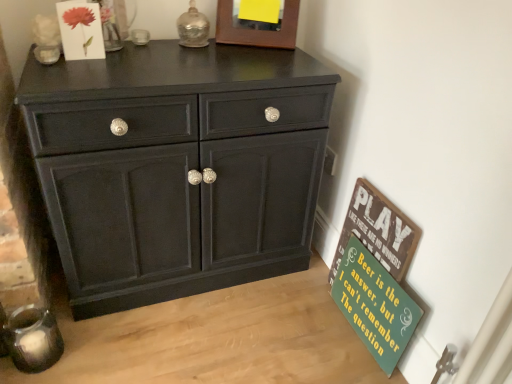
The height and width of the screenshot is (384, 512). What do you see at coordinates (378, 230) in the screenshot?
I see `green painted wood signboard at lower right, placed as the second bulletin board when sorted from bottom to top` at bounding box center [378, 230].

Locate an element on the screen. This screenshot has height=384, width=512. green wood signboard at lower right, which is counted as the 1th bulletin board, starting from the bottom is located at coordinates (374, 304).

Can green painted wood signboard at lower right, which ranks as the 1th bulletin board in top-to-bottom order, be found inside green wood signboard at lower right, which is counted as the 1th bulletin board, starting from the bottom?

That's correct, green painted wood signboard at lower right, which ranks as the 1th bulletin board in top-to-bottom order, is inside green wood signboard at lower right, which is counted as the 1th bulletin board, starting from the bottom.

Image resolution: width=512 pixels, height=384 pixels. What are the coordinates of `bulletin board below the green painted wood signboard at lower right, placed as the second bulletin board when sorted from bottom to top (from the image's perspective)` in the screenshot? It's located at (374, 304).

Considering the positions of objects green wood signboard at lower right, which is counted as the 1th bulletin board, starting from the bottom, and green painted wood signboard at lower right, placed as the second bulletin board when sorted from bottom to top, in the image provided, who is more to the left, green wood signboard at lower right, which is counted as the 1th bulletin board, starting from the bottom, or green painted wood signboard at lower right, placed as the second bulletin board when sorted from bottom to top,?

green painted wood signboard at lower right, placed as the second bulletin board when sorted from bottom to top.

Is matte black cabinet at center wider or thinner than green painted wood signboard at lower right, placed as the second bulletin board when sorted from bottom to top?

matte black cabinet at center is wider than green painted wood signboard at lower right, placed as the second bulletin board when sorted from bottom to top.

Which of these two, matte black cabinet at center or green painted wood signboard at lower right, placed as the second bulletin board when sorted from bottom to top, is smaller?

With smaller size is green painted wood signboard at lower right, placed as the second bulletin board when sorted from bottom to top.

From a real-world perspective, is matte black cabinet at center physically located above or below green painted wood signboard at lower right, placed as the second bulletin board when sorted from bottom to top?

matte black cabinet at center is situated higher than green painted wood signboard at lower right, placed as the second bulletin board when sorted from bottom to top, in the real world.

From a real-world perspective, is matte paper flower at upper left physically below matte black cabinet at center?

No, from a real-world perspective, matte paper flower at upper left is not beneath matte black cabinet at center.

Does matte paper flower at upper left appear on the right side of matte black cabinet at center?

No.

Considering the relative sizes of matte paper flower at upper left and matte black cabinet at center in the image provided, is matte paper flower at upper left smaller than matte black cabinet at center?

Yes.

From the image's perspective, who appears lower, matte paper flower at upper left or matte black cabinet at center?

matte black cabinet at center, from the image's perspective.

Starting from the wooden picture frame at upper center, which bulletin board is the 2nd one to the right? Please provide its 2D coordinates.

[(374, 304)]

Based on the photo, which of these two, green wood signboard at lower right, the second bulletin board positioned from the top, or wooden picture frame at upper center, is thinner?

With smaller width is wooden picture frame at upper center.

Does point (347, 319) come behind point (289, 1)?

That is True.

From a real-world perspective, who is located lower, green wood signboard at lower right, which is counted as the 1th bulletin board, starting from the bottom, or wooden picture frame at upper center?

green wood signboard at lower right, which is counted as the 1th bulletin board, starting from the bottom.

Is the position of wooden picture frame at upper center more distant than that of matte paper flower at upper left?

Yes, wooden picture frame at upper center is behind matte paper flower at upper left.

Is matte paper flower at upper left inside wooden picture frame at upper center?

No, matte paper flower at upper left is not a part of wooden picture frame at upper center.

From the image's perspective, does wooden picture frame at upper center appear lower than matte paper flower at upper left?

Actually, wooden picture frame at upper center appears above matte paper flower at upper left in the image.

Is wooden picture frame at upper center not near matte paper flower at upper left?

No, wooden picture frame at upper center is in close proximity to matte paper flower at upper left.

Can you confirm if wooden picture frame at upper center is shorter than green painted wood signboard at lower right, placed as the second bulletin board when sorted from bottom to top?

Yes, wooden picture frame at upper center is shorter than green painted wood signboard at lower right, placed as the second bulletin board when sorted from bottom to top.

Looking at their sizes, would you say wooden picture frame at upper center is wider or thinner than green painted wood signboard at lower right, which ranks as the 1th bulletin board in top-to-bottom order?

Clearly, wooden picture frame at upper center has more width compared to green painted wood signboard at lower right, which ranks as the 1th bulletin board in top-to-bottom order.

Locate an element on the screen. picture frame above the green painted wood signboard at lower right, which ranks as the 1th bulletin board in top-to-bottom order (from the image's perspective) is located at coordinates (257, 30).

How different are the orientations of wooden picture frame at upper center and green painted wood signboard at lower right, which ranks as the 1th bulletin board in top-to-bottom order, in degrees?

The angle between the facing direction of wooden picture frame at upper center and the facing direction of green painted wood signboard at lower right, which ranks as the 1th bulletin board in top-to-bottom order, is 63.7 degrees.

Looking at the image, does green painted wood signboard at lower right, placed as the second bulletin board when sorted from bottom to top, seem bigger or smaller compared to green wood signboard at lower right, the second bulletin board positioned from the top?

green painted wood signboard at lower right, placed as the second bulletin board when sorted from bottom to top, is bigger than green wood signboard at lower right, the second bulletin board positioned from the top.

Between point (391, 273) and point (348, 247), which one is positioned in front?

The point (391, 273) is closer.

Is green painted wood signboard at lower right, placed as the second bulletin board when sorted from bottom to top, facing away from green wood signboard at lower right, which is counted as the 1th bulletin board, starting from the bottom?

Yes, green painted wood signboard at lower right, placed as the second bulletin board when sorted from bottom to top, is positioned with its back facing green wood signboard at lower right, which is counted as the 1th bulletin board, starting from the bottom.

Between green painted wood signboard at lower right, which ranks as the 1th bulletin board in top-to-bottom order, and green wood signboard at lower right, which is counted as the 1th bulletin board, starting from the bottom, which one is positioned behind?

green painted wood signboard at lower right, which ranks as the 1th bulletin board in top-to-bottom order, is further away from the camera.

Where is `bulletin board lying above the green wood signboard at lower right, which is counted as the 1th bulletin board, starting from the bottom (from the image's perspective)`? bulletin board lying above the green wood signboard at lower right, which is counted as the 1th bulletin board, starting from the bottom (from the image's perspective) is located at coordinates (378, 230).

From the image's perspective, which bulletin board is the 1st one below the matte black cabinet at center? Please provide its 2D coordinates.

[(378, 230)]

Estimate the real-world distances between objects in this image. Which object is further from wooden picture frame at upper center, green painted wood signboard at lower right, which ranks as the 1th bulletin board in top-to-bottom order, or matte paper flower at upper left?

The object further to wooden picture frame at upper center is green painted wood signboard at lower right, which ranks as the 1th bulletin board in top-to-bottom order.

Consider the image. Based on their spatial positions, is green wood signboard at lower right, which is counted as the 1th bulletin board, starting from the bottom, or wooden picture frame at upper center further from green painted wood signboard at lower right, which ranks as the 1th bulletin board in top-to-bottom order?

The object further to green painted wood signboard at lower right, which ranks as the 1th bulletin board in top-to-bottom order, is wooden picture frame at upper center.

Consider the image. Estimate the real-world distances between objects in this image. Which object is further from green painted wood signboard at lower right, placed as the second bulletin board when sorted from bottom to top, green wood signboard at lower right, which is counted as the 1th bulletin board, starting from the bottom, or matte paper flower at upper left?

Based on the image, matte paper flower at upper left appears to be further to green painted wood signboard at lower right, placed as the second bulletin board when sorted from bottom to top.

Based on their spatial positions, is matte paper flower at upper left or green painted wood signboard at lower right, placed as the second bulletin board when sorted from bottom to top, closer to matte black cabinet at center?

green painted wood signboard at lower right, placed as the second bulletin board when sorted from bottom to top.

When comparing their distances from wooden picture frame at upper center, does green wood signboard at lower right, the second bulletin board positioned from the top, or matte black cabinet at center seem closer?

matte black cabinet at center is positioned closer to the anchor wooden picture frame at upper center.

Based on the photo, looking at the image, which one is located further to wooden picture frame at upper center, matte black cabinet at center or green wood signboard at lower right, which is counted as the 1th bulletin board, starting from the bottom?

green wood signboard at lower right, which is counted as the 1th bulletin board, starting from the bottom.

Which object lies further to the anchor point green wood signboard at lower right, which is counted as the 1th bulletin board, starting from the bottom, green painted wood signboard at lower right, placed as the second bulletin board when sorted from bottom to top, or matte black cabinet at center?

Based on the image, matte black cabinet at center appears to be further to green wood signboard at lower right, which is counted as the 1th bulletin board, starting from the bottom.

Based on their spatial positions, is wooden picture frame at upper center or matte black cabinet at center further from green painted wood signboard at lower right, placed as the second bulletin board when sorted from bottom to top?

Based on the image, wooden picture frame at upper center appears to be further to green painted wood signboard at lower right, placed as the second bulletin board when sorted from bottom to top.

This screenshot has width=512, height=384. Identify the location of chest of drawers between wooden picture frame at upper center and green wood signboard at lower right, which is counted as the 1th bulletin board, starting from the bottom, from top to bottom. (177, 168).

Where is `bulletin board situated between matte paper flower at upper left and green wood signboard at lower right, the second bulletin board positioned from the top, from left to right`? bulletin board situated between matte paper flower at upper left and green wood signboard at lower right, the second bulletin board positioned from the top, from left to right is located at coordinates (378, 230).

Identify the location of chest of drawers between wooden picture frame at upper center and green painted wood signboard at lower right, placed as the second bulletin board when sorted from bottom to top, in the up-down direction. (177, 168).

Find the location of a particular element. The width and height of the screenshot is (512, 384). chest of drawers between matte paper flower at upper left and green wood signboard at lower right, the second bulletin board positioned from the top, in the horizontal direction is located at coordinates (177, 168).